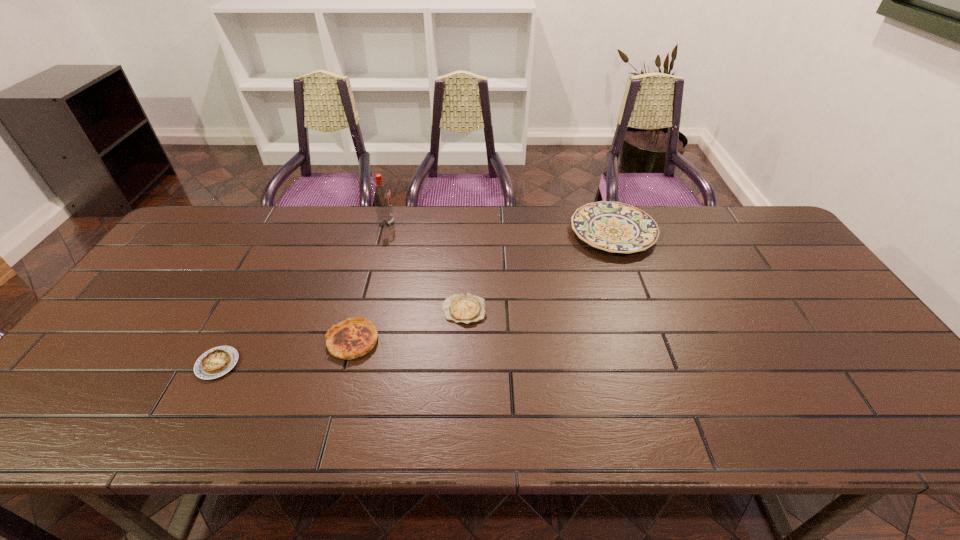
Select which object is the closest to the tallest object. Please provide its 2D coordinates. Your answer should be formatted as a tuple, i.e. [(x, y)], where the tuple contains the x and y coordinates of a point satisfying the conditions above.

[(466, 308)]

Where is `quiche that is the closest one to the tallest object`? quiche that is the closest one to the tallest object is located at coordinates (466, 308).

Identify which quiche is located as the second nearest to the tallest quiche. Please provide its 2D coordinates. Your answer should be formatted as a tuple, i.e. [(x, y)], where the tuple contains the x and y coordinates of a point satisfying the conditions above.

[(216, 362)]

What are the coordinates of `vacant space that satisfies the following two spatial constraints: 1. on the back side of the second shortest quiche; 2. on the left side of the rightmost object` in the screenshot? It's located at (287, 232).

Locate an element on the screen. blank space that satisfies the following two spatial constraints: 1. on the back side of the plate; 2. on the front label of the tallest object is located at coordinates (610, 224).

The height and width of the screenshot is (540, 960). Find the location of `vacant space that satisfies the following two spatial constraints: 1. on the back side of the rightmost object; 2. on the right side of the second object from right to left`. vacant space that satisfies the following two spatial constraints: 1. on the back side of the rightmost object; 2. on the right side of the second object from right to left is located at coordinates (467, 232).

You are a GUI agent. You are given a task and a screenshot of the screen. Output one action in this format:
    pyautogui.click(x=<x>, y=<y>)
    Task: Click on the blank space that satisfies the following two spatial constraints: 1. on the front label of the tallest object; 2. on the right side of the rightmost quiche
    
    Given the screenshot: What is the action you would take?
    pyautogui.click(x=364, y=310)

Locate an element on the screen. blank space that satisfies the following two spatial constraints: 1. on the back side of the shortest quiche; 2. on the right side of the leftmost object is located at coordinates (246, 310).

I want to click on free space that satisfies the following two spatial constraints: 1. on the front label of the vodka; 2. on the left side of the plate, so click(x=384, y=232).